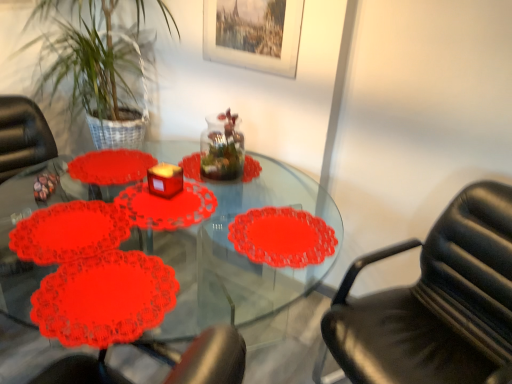
Locate an element on the screen. Image resolution: width=512 pixels, height=384 pixels. free space in front of matte red candle at center is located at coordinates (152, 213).